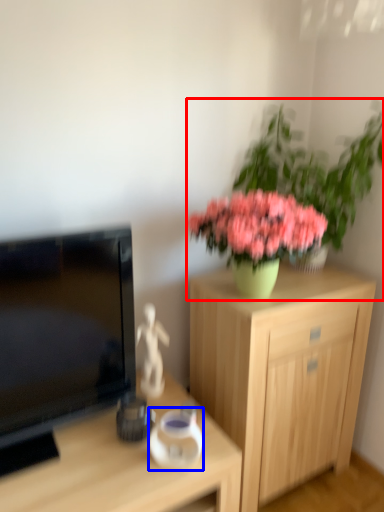
Question: Which object is further to the camera taking this photo, houseplant (highlighted by a red box) or vase (highlighted by a blue box)?

Choices:
 (A) houseplant
 (B) vase

Answer: (A)